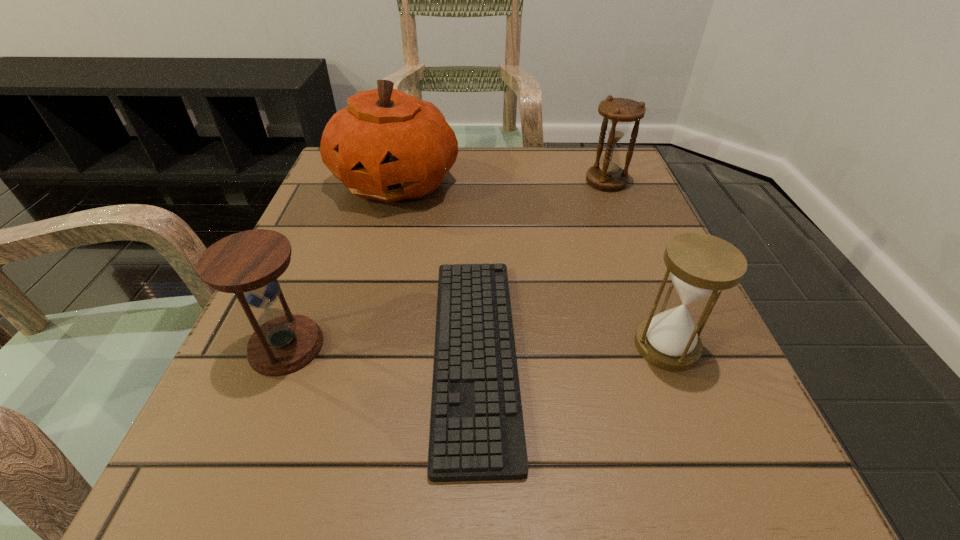
Image resolution: width=960 pixels, height=540 pixels. Identify the location of vacant space that satisfies the following two spatial constraints: 1. on the front-facing side of the farthest hourglass; 2. on the right side of the pumpkin. (396, 181).